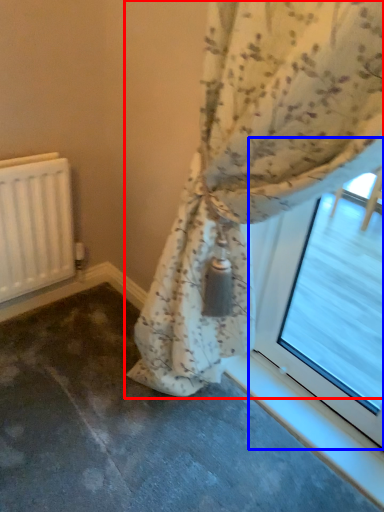
Question: Which point is closer to the camera, curtain (highlighted by a red box) or bay window (highlighted by a blue box)?

Choices:
 (A) curtain
 (B) bay window

Answer: (A)